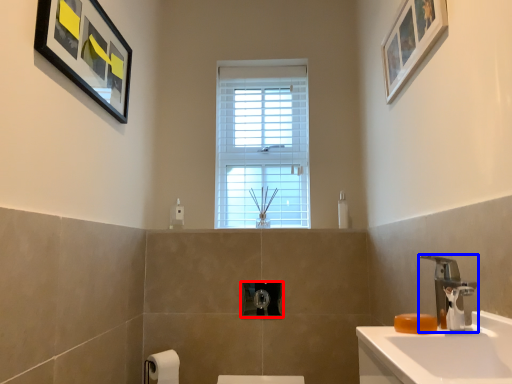
Question: Among these objects, which one is farthest to the camera, towel bar (highlighted by a red box) or tap (highlighted by a blue box)?

Choices:
 (A) towel bar
 (B) tap

Answer: (A)